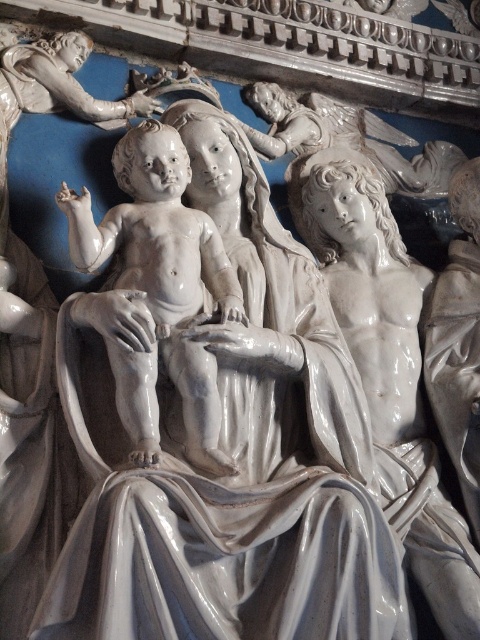
Which is behind, point (237, 304) or point (384, 212)?

The point (384, 212) is behind.

Between point (167, 348) and point (375, 316), which one is positioned in front?

Positioned in front is point (167, 348).

What are the coordinates of `matte white baby at center` in the screenshot? It's located at (159, 289).